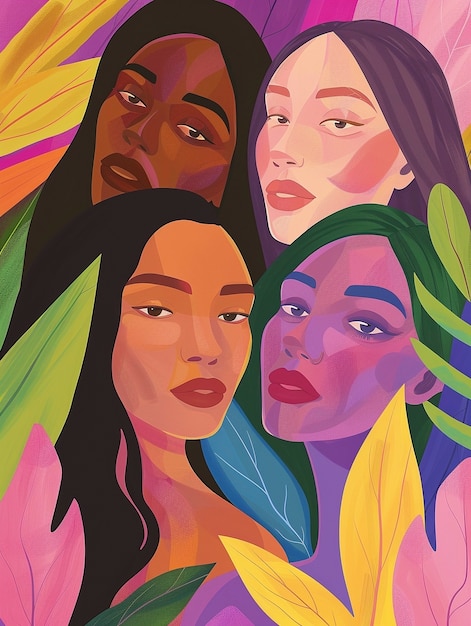
Find the location of `art piece`. art piece is located at coordinates (243, 295).